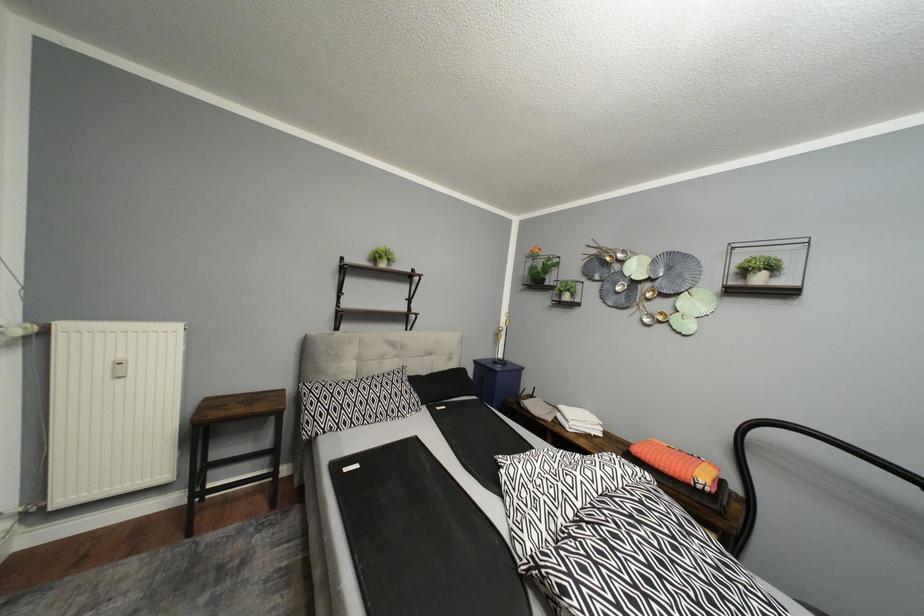
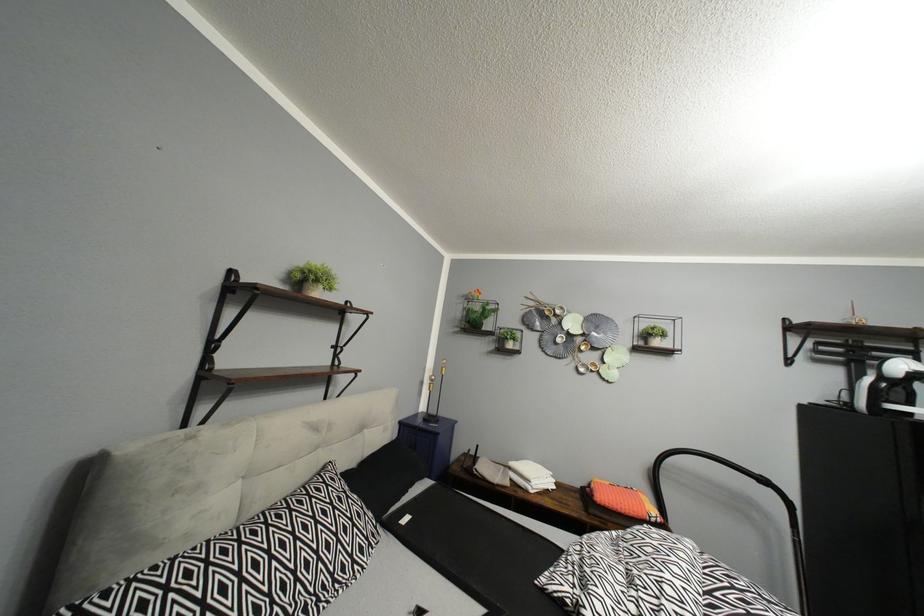
Question: The camera is either moving clockwise (left) or counter-clockwise (right) around the object. The first image is from the beginning of the video and the second image is from the end. Is the camera moving left or right when shooting the video?

Choices:
 (A) Left
 (B) Right

Answer: (A)